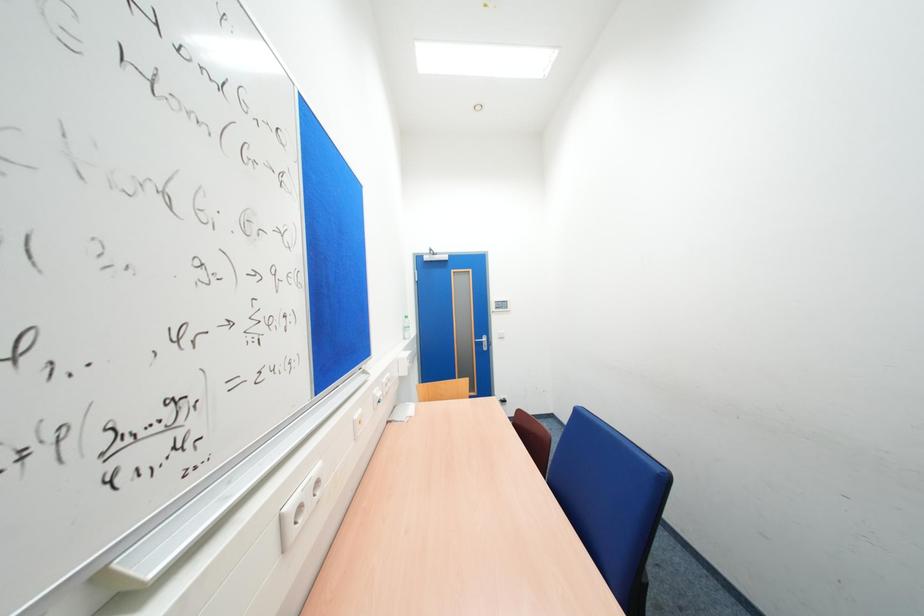
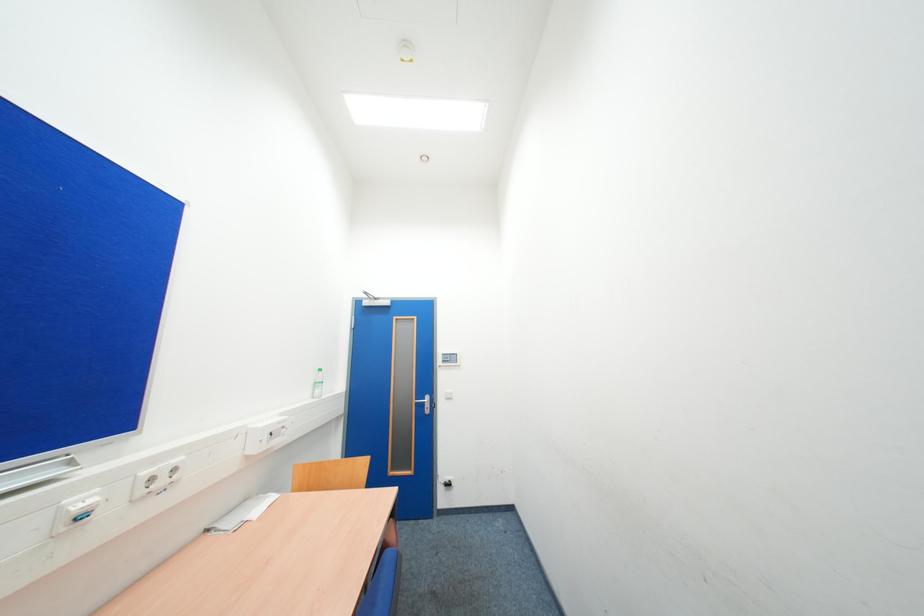
Question: Based on the continuous images, in which direction is the camera rotating? Reply with the corresponding letter.

Choices:
 (A) Left
 (B) Right
 (C) Up
 (D) Down

Answer: (C)